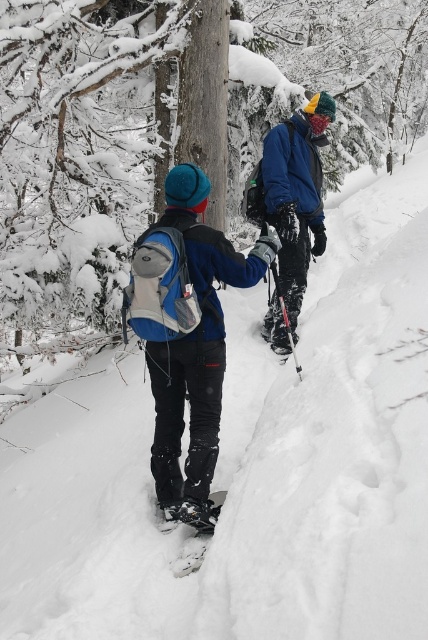
Which is more to the left, blue matte jacket at center or black matte ski at lower center?

black matte ski at lower center

In order to click on blue matte jacket at center in this screenshot , I will do `click(296, 193)`.

How far apart are matte blue jacket at center and black matte ski at lower center?

matte blue jacket at center and black matte ski at lower center are 37.50 centimeters apart from each other.

Can you confirm if matte blue jacket at center is positioned to the left of black matte ski at lower center?

Incorrect, matte blue jacket at center is not on the left side of black matte ski at lower center.

Where is `matte blue jacket at center`? matte blue jacket at center is located at coordinates (228, 284).

Who is positioned more to the left, matte blue jacket at center or blue matte jacket at center?

Positioned to the left is matte blue jacket at center.

Which is more to the right, matte blue jacket at center or blue matte jacket at center?

From the viewer's perspective, blue matte jacket at center appears more on the right side.

Does point (184, 220) come farther from viewer compared to point (269, 198)?

No.

Locate an element on the screen. matte blue jacket at center is located at coordinates (228, 284).